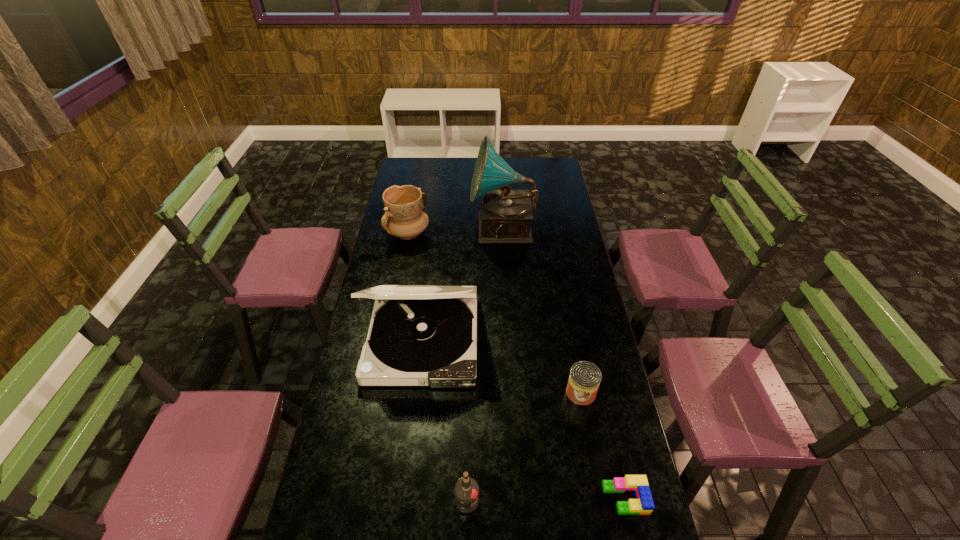
I want to click on record player, so click(505, 215).

The width and height of the screenshot is (960, 540). Find the location of `the fifth shortest object`. the fifth shortest object is located at coordinates (420, 335).

The height and width of the screenshot is (540, 960). In order to click on pottery in this screenshot , I will do `click(404, 217)`.

In order to click on vodka in this screenshot , I will do `click(466, 491)`.

At what (x,y) coordinates should I click in order to perform the action: click on can. Please return your answer as a coordinate pair (x, y). Looking at the image, I should click on (585, 377).

Locate an element on the screen. Lego is located at coordinates (643, 504).

The height and width of the screenshot is (540, 960). What are the coordinates of `free region located on the horn of the record player` in the screenshot? It's located at (447, 230).

This screenshot has height=540, width=960. I want to click on vacant space located 0.280m on the horn of the record player, so click(x=412, y=230).

Find the location of a particular element. The width and height of the screenshot is (960, 540). vacant point located 0.340m on the horn of the record player is located at coordinates (398, 230).

Identify the location of vacant space located 0.180m on the control panel of the CD player. The width and height of the screenshot is (960, 540). (411, 443).